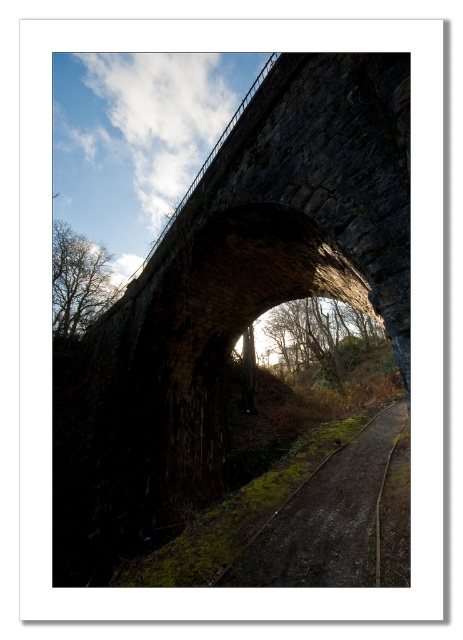
You are standing at the base of the stone archway and want to walk towards the opening where the sunlight is coming through. There are two points marked on the ground, point (287, 84) and point (354, 573). Which point should you step on first to reach the sunlight?

You should step on point (354, 573) first because point (287, 84) is behind it, meaning point (354, 573) is closer to the opening where the sunlight is coming through.

You are a hiker standing at the entrance of the dark stone bridge at center and the brown dirt track at center. Which path is closer to you?

The dark stone bridge at center is closer to you since it is in front of the brown dirt track at center.

You are a hiker carrying a large backpack and need to cross the dark stone bridge at center. The brown dirt track at center leads to the bridge. Can you safely walk from the dirt track onto the bridge?

The dark stone bridge at center is wider than the brown dirt track at center, so yes, you can safely walk from the dirt track onto the bridge since the bridge provides a wider surface area to move onto.